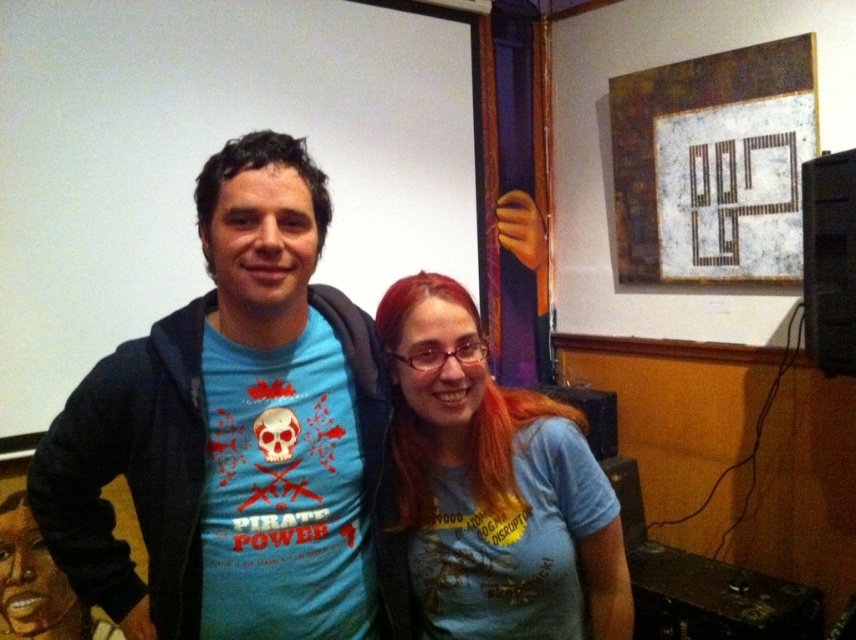
Is blue t-shirt at center to the right of blue cotton shirt at center from the viewer's perspective?

Incorrect, blue t-shirt at center is not on the right side of blue cotton shirt at center.

Can you confirm if blue t-shirt at center is bigger than blue cotton shirt at center?

Correct, blue t-shirt at center is larger in size than blue cotton shirt at center.

Between point (312, 611) and point (486, 486), which one is positioned behind?

Positioned behind is point (486, 486).

This screenshot has height=640, width=856. Find the location of `blue t-shirt at center`. blue t-shirt at center is located at coordinates (236, 435).